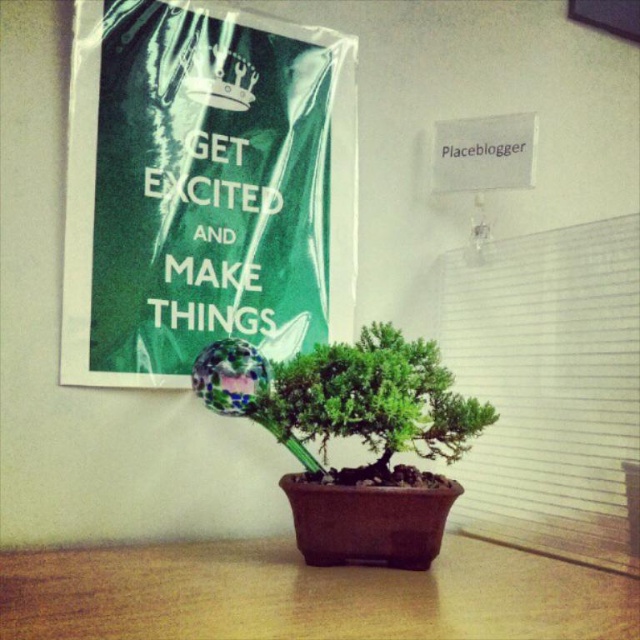
Question: Is brown wood table at center further to the viewer compared to green glossy bonsai tree at center?

Choices:
 (A) no
 (B) yes

Answer: (A)

Question: Can you confirm if brown wood table at center is thinner than green glossy bonsai tree at center?

Choices:
 (A) no
 (B) yes

Answer: (A)

Question: Which point appears farthest from the camera in this image?

Choices:
 (A) tap(426, 442)
 (B) tap(29, 560)

Answer: (A)

Question: Observing the image, what is the correct spatial positioning of brown wood table at center in reference to green glossy bonsai tree at center?

Choices:
 (A) below
 (B) above

Answer: (A)